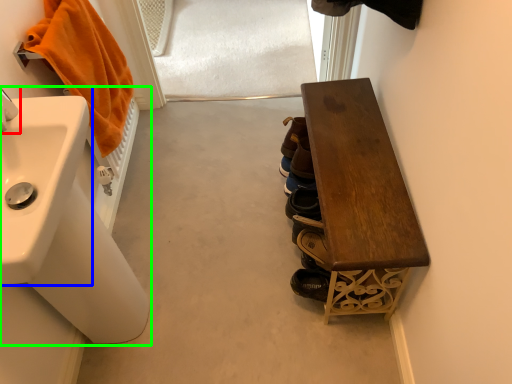
Question: Considering the real-world distances, which object is farthest from tap (highlighted by a red box)? sink (highlighted by a blue box) or sink (highlighted by a green box)?

Choices:
 (A) sink
 (B) sink

Answer: (B)